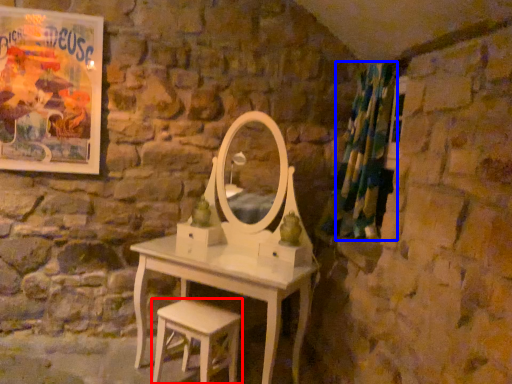
Question: Which of the following is the closest to the observer, stool (highlighted by a red box) or shower curtain (highlighted by a blue box)?

Choices:
 (A) stool
 (B) shower curtain

Answer: (A)